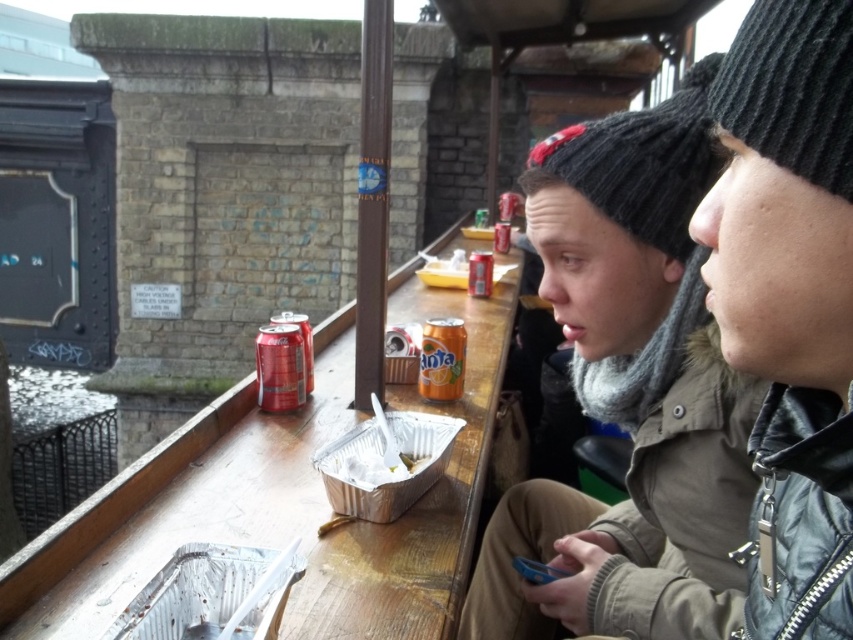
Question: Which object is closer to the camera taking this photo?

Choices:
 (A) wooden table at center
 (B) orange matte soda can at center

Answer: (A)

Question: Estimate the real-world distances between objects in this image. Which object is closer to the orange matte can at center?

Choices:
 (A) black knitted hat at upper right
 (B) orange matte soda can at center
 (C) black knitted hat at center

Answer: (C)

Question: Is wooden table at center bigger than orange matte can at center?

Choices:
 (A) yes
 (B) no

Answer: (A)

Question: Which point is farther from the camera taking this photo?

Choices:
 (A) (323, 340)
 (B) (492, 266)
 (C) (697, 307)
 (D) (442, 346)

Answer: (B)

Question: Does knitted woolen hat at upper right have a greater width compared to orange matte can at center?

Choices:
 (A) no
 (B) yes

Answer: (B)

Question: Can you confirm if knitted woolen hat at upper right is positioned to the right of orange matte can at center?

Choices:
 (A) yes
 (B) no

Answer: (A)